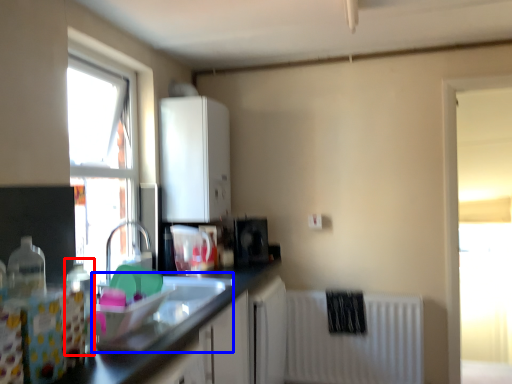
Question: Which point is closer to the camera, bottle (highlighted by a red box) or sink (highlighted by a blue box)?

Choices:
 (A) bottle
 (B) sink

Answer: (A)